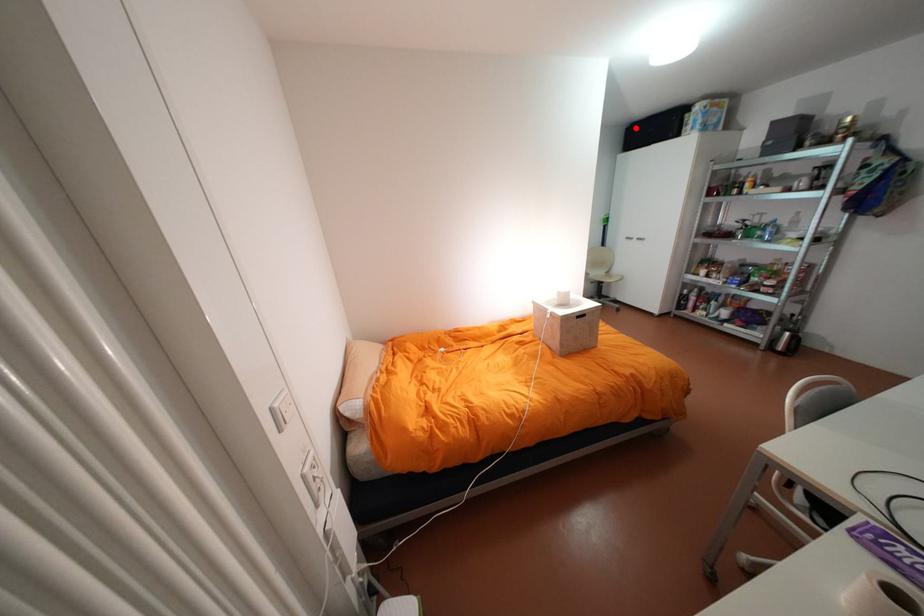
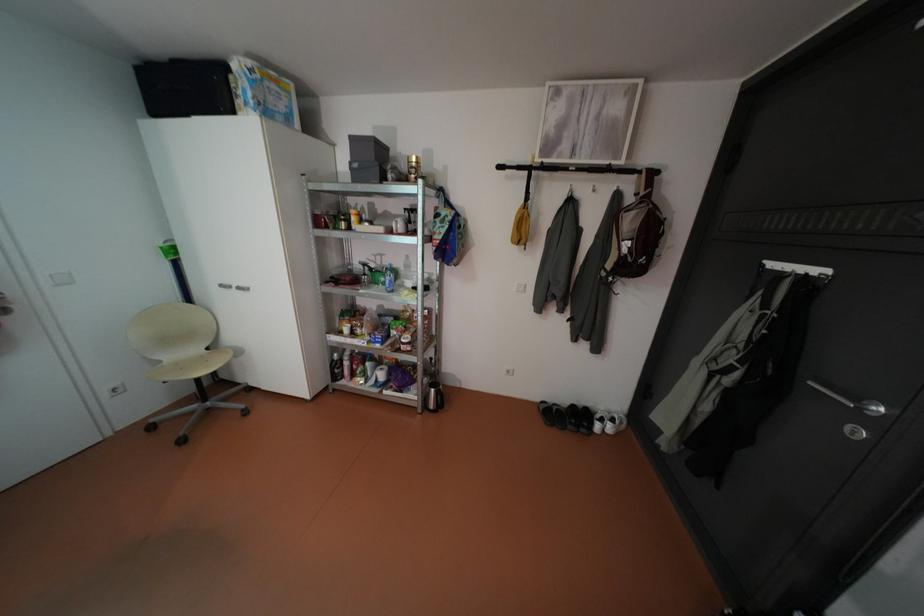
The point at the highlighted location is marked in the first image. Where is the corresponding point in the second image?

(147, 69)